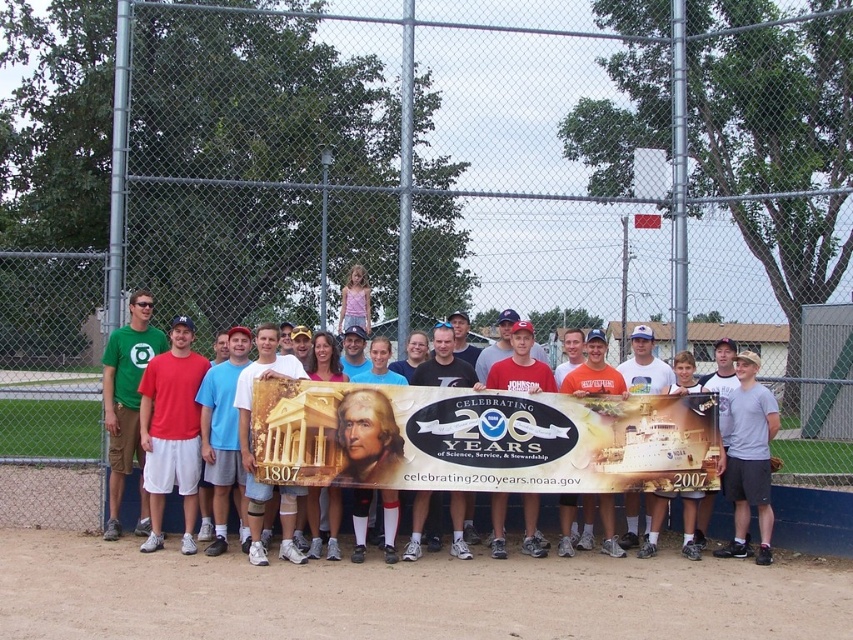
Question: In this image, where is matte white banner at center located relative to white cotton t-shirt at center?

Choices:
 (A) left
 (B) right

Answer: (A)

Question: Is matte red t-shirt at left positioned at the back of matte black t-shirt at center?

Choices:
 (A) no
 (B) yes

Answer: (B)

Question: Which of the following is the closest to the observer?

Choices:
 (A) (148, 348)
 (B) (187, 385)

Answer: (B)

Question: Which object is closer to the camera taking this photo?

Choices:
 (A) matte black t-shirt at center
 (B) matte red t-shirt at left
 (C) matte white banner at center

Answer: (C)

Question: Which object is positioned farthest from the gray cotton t-shirt at center?

Choices:
 (A) matte black t-shirt at center
 (B) green matte t-shirt at center

Answer: (B)

Question: Does matte red t-shirt at left have a smaller size compared to matte black t-shirt at center?

Choices:
 (A) yes
 (B) no

Answer: (B)